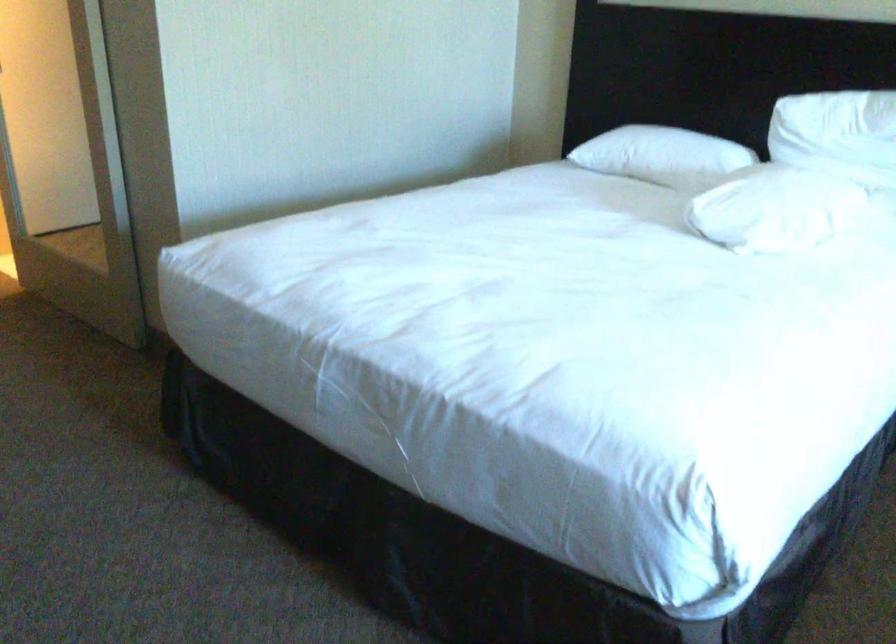
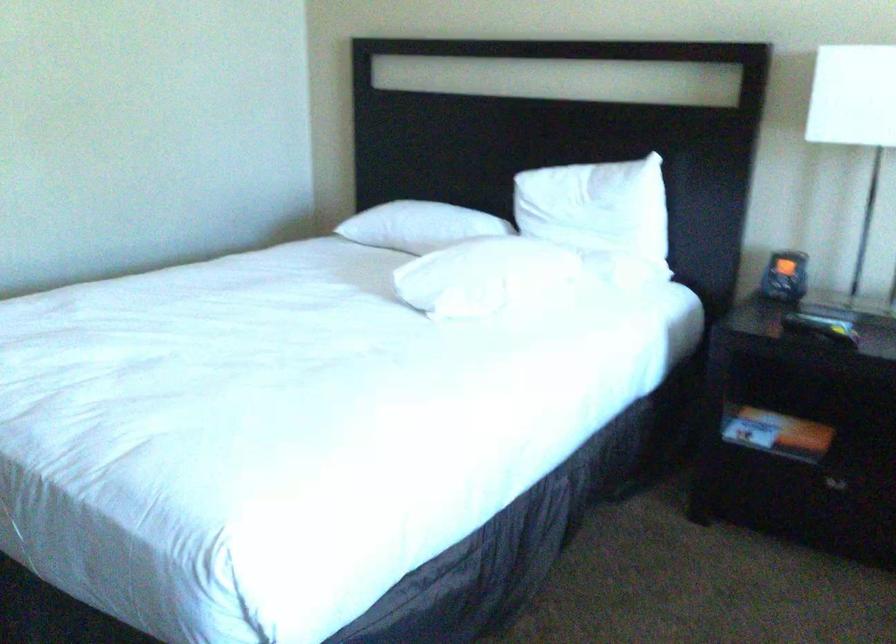
The point at [804,202] is marked in the first image. Where is the corresponding point in the second image?

(485, 276)